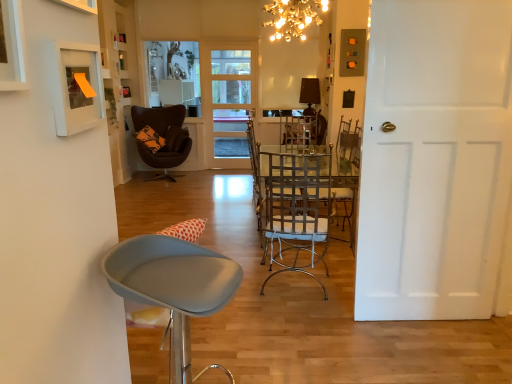
Question: From the image's perspective, is white matte picture frame at upper left, acting as the 1th picture frame starting from the front, positioned above or below white matte door at right, acting as the first door starting from the right?

Choices:
 (A) below
 (B) above

Answer: (B)

Question: Considering the positions of point (10, 79) and point (386, 244), is point (10, 79) closer or farther from the camera than point (386, 244)?

Choices:
 (A) closer
 (B) farther

Answer: (A)

Question: Based on their relative distances, which object is nearer to the white matte picture frame at upper left, which is the first picture frame from left to right?

Choices:
 (A) matte black lampshade at upper center, the first lamp viewed from the right
 (B) white matte picture frame at upper left, which is the 3th picture frame in top-to-bottom order
 (C) white matte door at right, which is counted as the 2th door, starting from the left
 (D) dark brown leather chair at center, which is counted as the first chair, starting from the back
 (E) metallic switch plate at upper right, the 3th picture frame positioned from the left

Answer: (B)

Question: Which of these objects is positioned closest to the white matte picture frame at upper left, placed as the 2th picture frame when sorted from bottom to top?

Choices:
 (A) dark brown leather chair at center, which is counted as the first chair, starting from the back
 (B) shiny gold chandelier at upper center, acting as the 2th lamp starting from the back
 (C) matte gray stool at lower left, acting as the second chair starting from the left
 (D) white matte picture frame at upper left, which is the 2th picture frame from front to back
 (E) metallic silver chair at center, which ranks as the 2th chair in front-to-back order

Answer: (D)